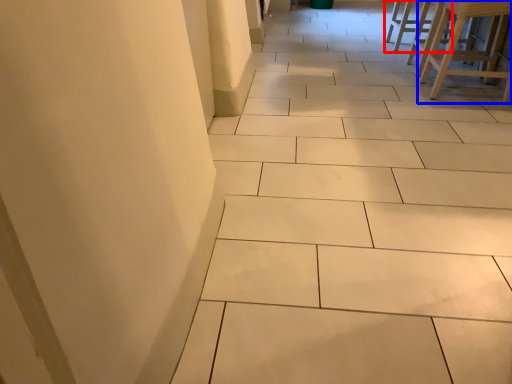
Question: Which point is further to the camera, furniture (highlighted by a red box) or furniture (highlighted by a blue box)?

Choices:
 (A) furniture
 (B) furniture

Answer: (A)